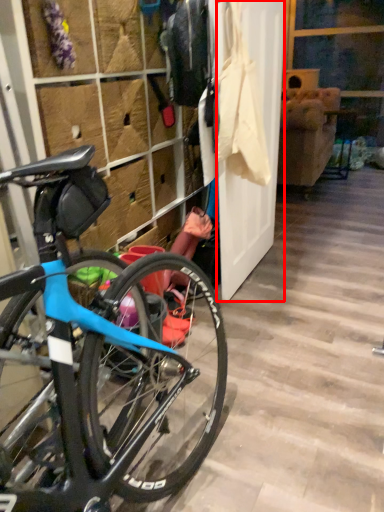
Question: From the image's perspective, where is screen door (annotated by the red box) located in relation to closet in the image?

Choices:
 (A) below
 (B) above

Answer: (B)